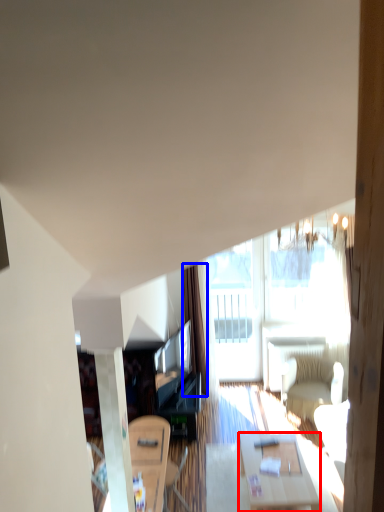
Question: Among these objects, which one is nearest to the camera, table (highlighted by a red box) or curtain (highlighted by a blue box)?

Choices:
 (A) table
 (B) curtain

Answer: (A)